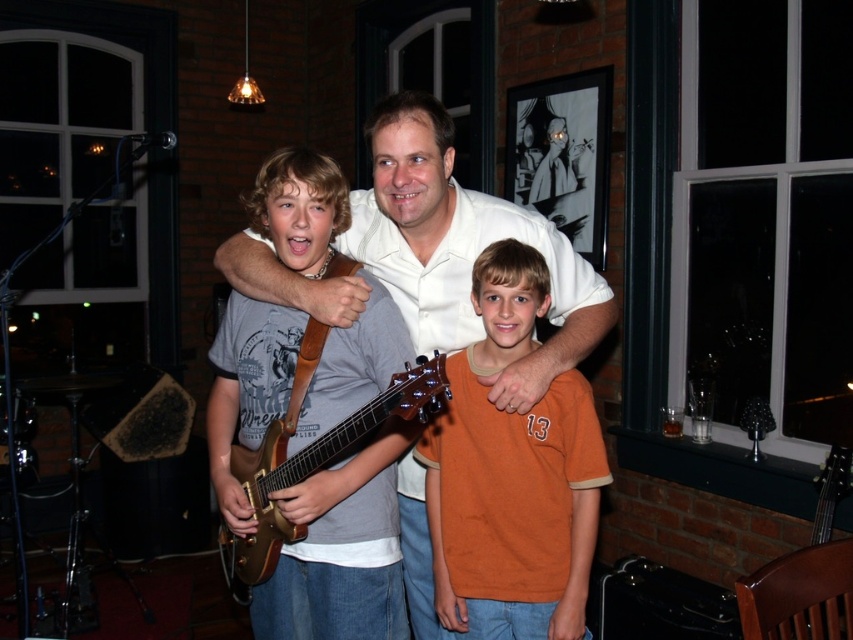
From the picture: Does wooden electric guitar at center have a lesser height compared to white smooth shirt at center?

In fact, wooden electric guitar at center may be taller than white smooth shirt at center.

Where is `wooden electric guitar at center`? The height and width of the screenshot is (640, 853). wooden electric guitar at center is located at coordinates (340, 552).

The width and height of the screenshot is (853, 640). I want to click on wooden electric guitar at center, so click(x=340, y=552).

Is orange cotton shirt at center positioned in front of white smooth shirt at center?

That is True.

Between orange cotton shirt at center and white smooth shirt at center, which one is positioned lower?

orange cotton shirt at center is below.

Identify the location of orange cotton shirt at center. (511, 476).

Is point (473, 577) behind point (322, 468)?

Yes, point (473, 577) is farther from viewer.

Which of these two, orange cotton shirt at center or gold metallic guitar at center, stands taller?

orange cotton shirt at center is taller.

Measure the distance between point (x=428, y=465) and camera.

Point (x=428, y=465) and camera are 1.81 meters apart.

Image resolution: width=853 pixels, height=640 pixels. Identify the location of orange cotton shirt at center. (511, 476).